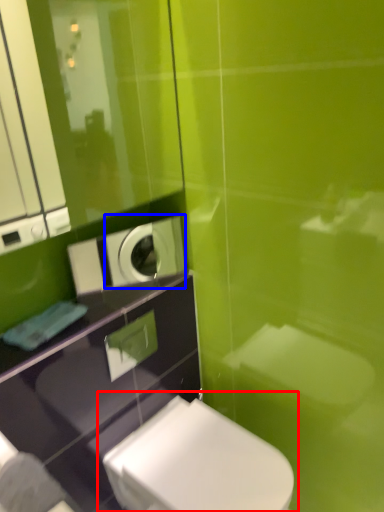
Question: Which point is closer to the camera, toilet (highlighted by a red box) or appliance (highlighted by a blue box)?

Choices:
 (A) toilet
 (B) appliance

Answer: (A)